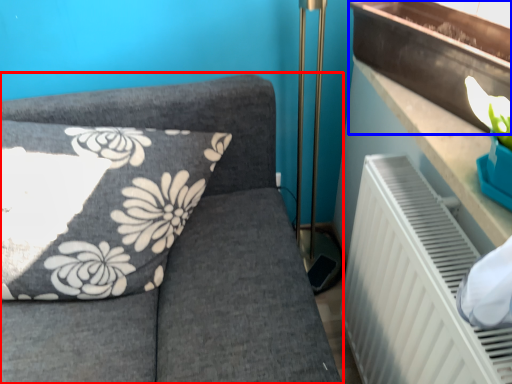
Question: Which point is closer to the camera, furniture (highlighted by a red box) or window sill (highlighted by a blue box)?

Choices:
 (A) furniture
 (B) window sill

Answer: (B)